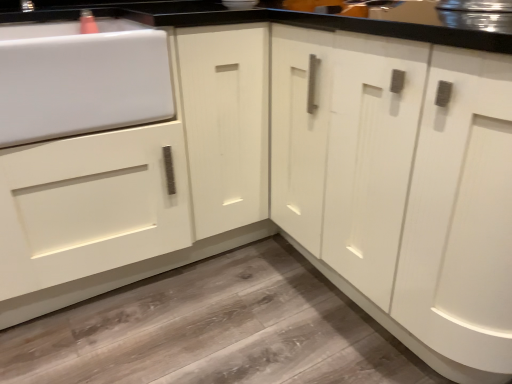
Locate an element on the screen. The image size is (512, 384). white matte cabinet at center is located at coordinates (407, 190).

This screenshot has height=384, width=512. Describe the element at coordinates (407, 190) in the screenshot. I see `white matte cabinet at center` at that location.

Locate an element on the screen. This screenshot has height=384, width=512. white matte cabinet at center is located at coordinates (407, 190).